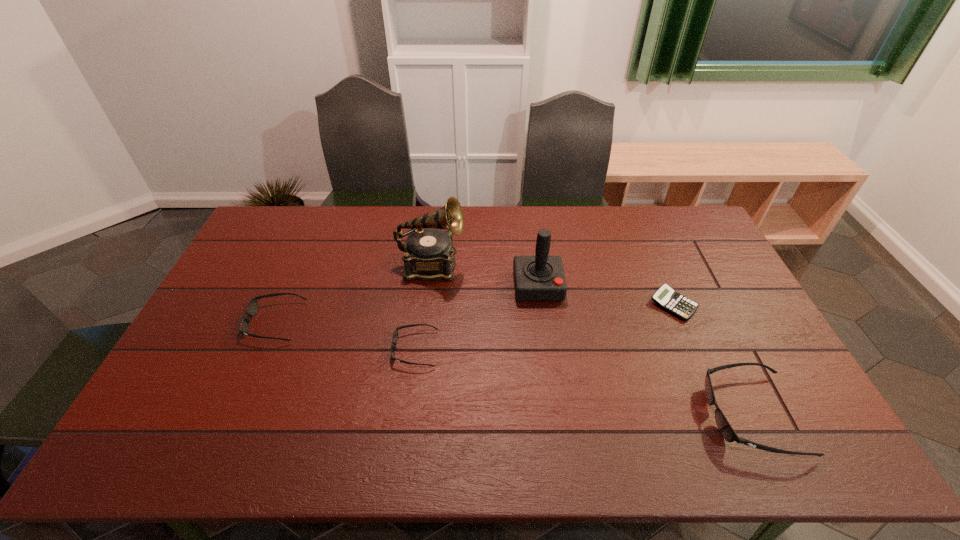
Please mark a free spot for a new sunglasses to balance the arrangement. Please provide its 2D coordinates. Your answer should be formatted as a tuple, i.e. [(x, y)], where the tuple contains the x and y coordinates of a point satisfying the conditions above.

[(573, 380)]